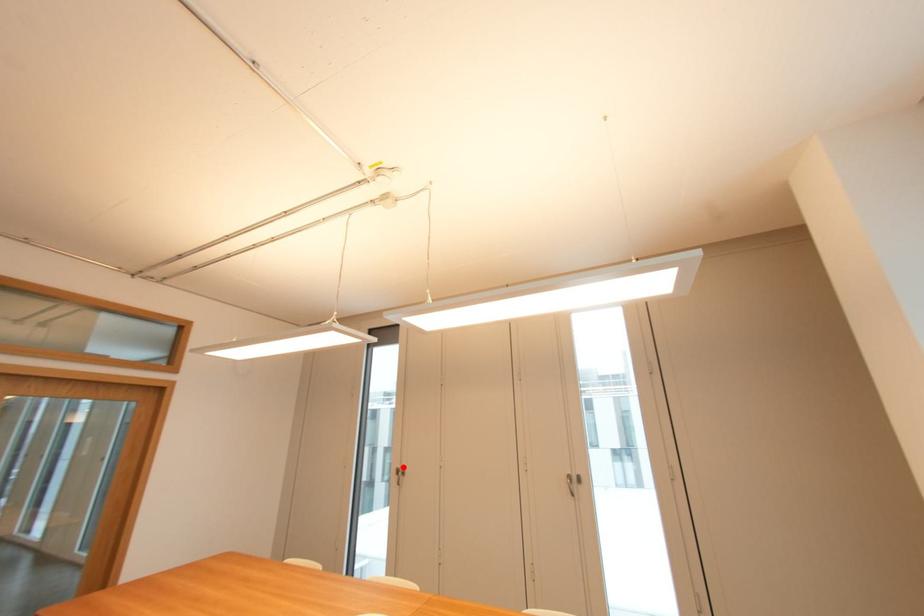
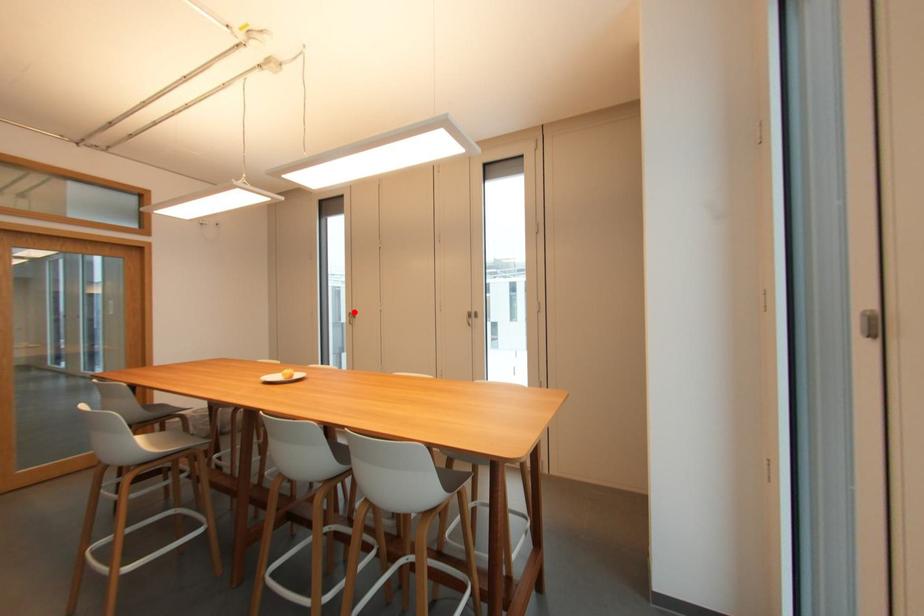
I am providing you with two images of the same scene from different viewpoints. A red point is marked on the first image and another point is marked on the second image. Is the red point in image1 aligned with the point shown in image2?

Yes